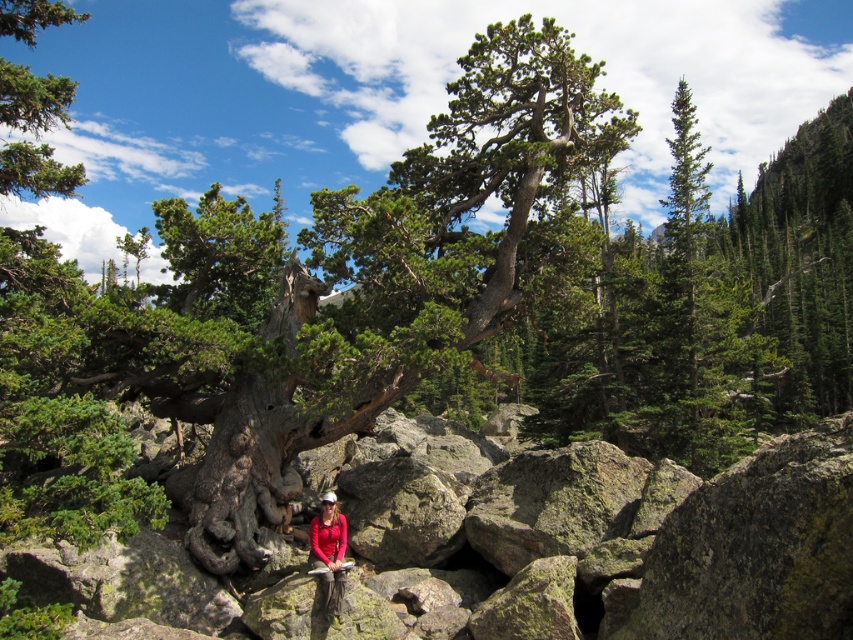
You are a hiker trying to navigate through the rocky terrain. You see the green mossy rock at center and the gray rough boulder at center. Which one should you step on first if you want to reach the tree trunk behind them?

You should step on the green mossy rock at center first because it is closer to you than the gray rough boulder at center, allowing you to reach the tree trunk more directly.

You are a hiker navigating a rugged landscape with a large tree and rocky terrain. You see two points marked on your map at coordinates point (404, 541) and point (343, 586). Which point is closer to you as you stand at the base of the tree?

Point (404, 541) is closer to you because it is further to the viewer than point (343, 586), meaning it is nearer in the visual perspective.